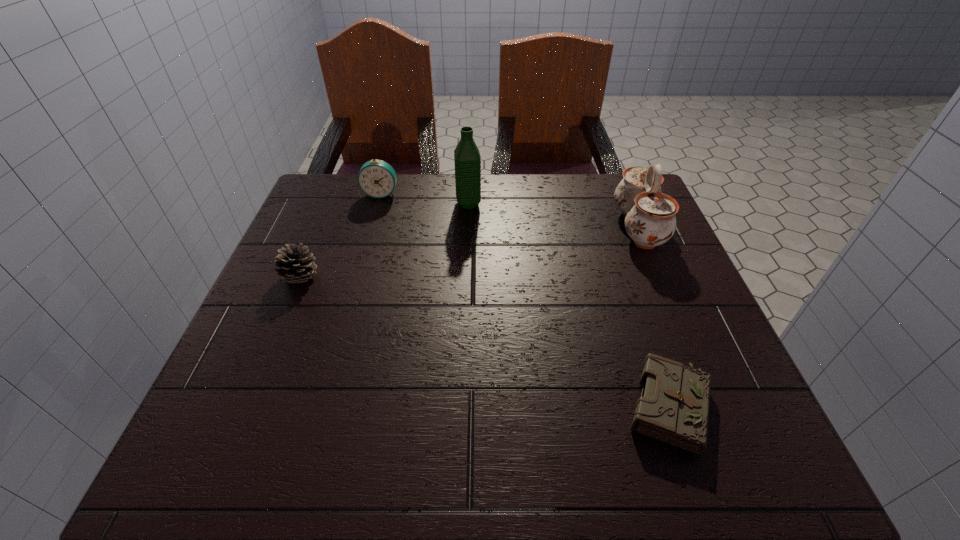
What are the coordinates of `free space located 0.100m by the handle of the fourth shortest object` in the screenshot? It's located at (575, 227).

Image resolution: width=960 pixels, height=540 pixels. Identify the location of vacant space situated 0.150m by the handle of the fourth shortest object. (555, 227).

The width and height of the screenshot is (960, 540). I want to click on vacant space located by the handle of the fourth shortest object, so point(583,227).

This screenshot has height=540, width=960. Find the location of `free space located 0.060m on the front-facing side of the alarm clock`. free space located 0.060m on the front-facing side of the alarm clock is located at coordinates (375, 213).

Image resolution: width=960 pixels, height=540 pixels. I want to click on vacant area situated 0.170m on the back of the pinecone, so click(324, 220).

Find the location of a particular element. This screenshot has height=540, width=960. free space located on the back of the nearest object is located at coordinates (624, 273).

Image resolution: width=960 pixels, height=540 pixels. I want to click on water bottle located in the far edge section of the desktop, so (467, 158).

Where is `chinaware present at the far edge`? This screenshot has width=960, height=540. chinaware present at the far edge is located at coordinates (650, 221).

Locate an element on the screen. alarm clock that is positioned at the far edge is located at coordinates (376, 178).

Identify the location of object at the near edge. (673, 408).